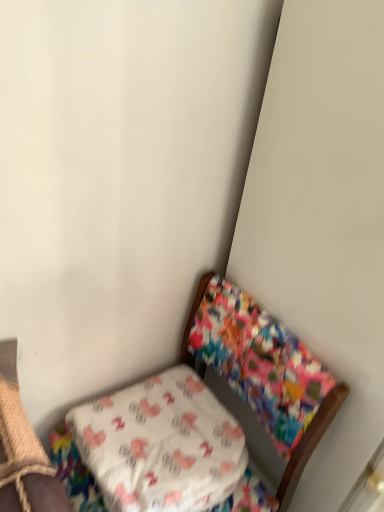
Find the location of a particular element. This screenshot has width=384, height=512. free space above white fabric pillow at lower left (from a real-world perspective) is located at coordinates (165, 425).